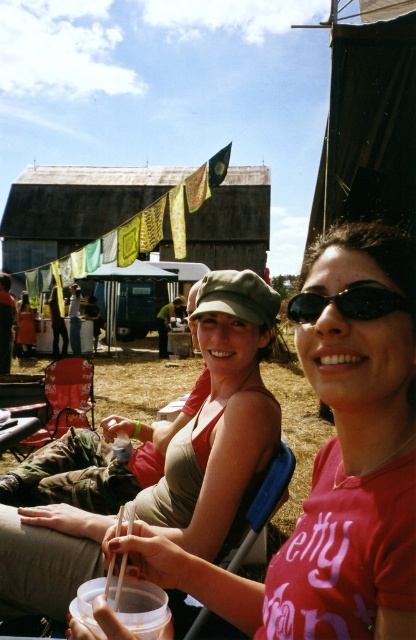
From the picture: You are a photographer adjusting your camera settings. You notice the matte khaki cap at center and the black plastic sunglasses at center in the frame. Which object is positioned lower in the image?

The matte khaki cap at center is below the black plastic sunglasses at center, so it is positioned lower in the image.

You are a photographer trying to capture both the matte green cap at center and the matte khaki cap at center in a single frame. Which cap should you adjust your camera angle to focus on first if you want to ensure both are fully visible, considering their sizes?

The matte green cap at center has a lesser width compared to the matte khaki cap at center, so you should focus on the matte khaki cap at center first to ensure both fit within the frame.